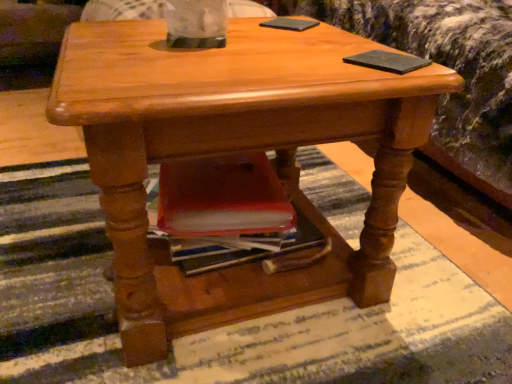
Find the location of a particular element. This screenshot has height=384, width=512. free location in front of black matte pad at upper right, which appears as the first pad when viewed from the front is located at coordinates (388, 77).